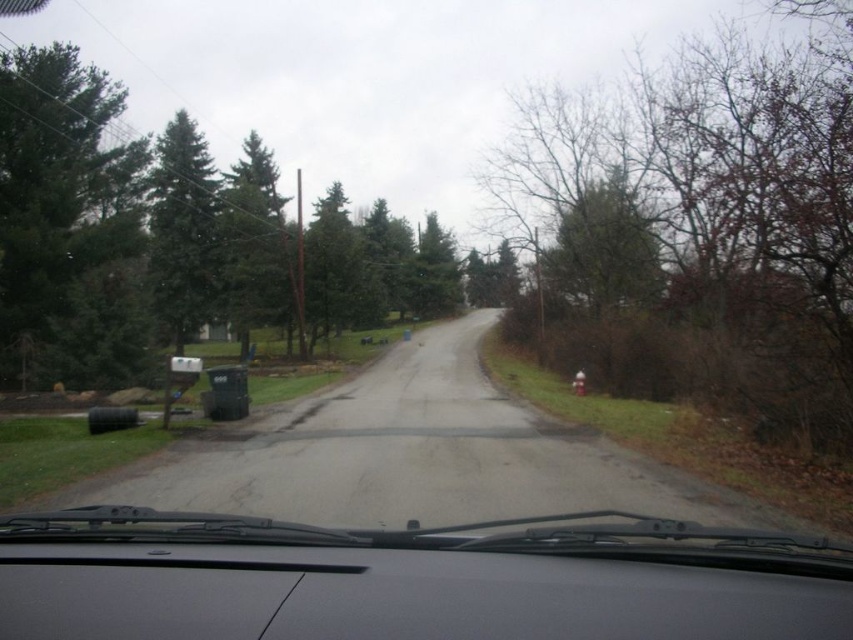
Is point (819, 316) in front of point (791, 637)?

No, (819, 316) is behind (791, 637).

Between bare branches at right and black matte windshield wipers at center, which one has more height?

bare branches at right is taller.

Is point (798, 380) in front of point (241, 570)?

No.

The image size is (853, 640). Identify the location of bare branches at right. (700, 228).

Can you confirm if green textured tree at left is taller than green matte tree at left?

Yes.

Consider the image. Who is more forward, (x=86, y=378) or (x=184, y=298)?

Point (x=86, y=378) is more forward.

Where is `green textured tree at left`? This screenshot has height=640, width=853. green textured tree at left is located at coordinates 68,227.

I want to click on green textured tree at left, so click(68, 227).

Is point (706, 252) closer to camera compared to point (178, 115)?

Yes, it is.

Between point (560, 227) and point (160, 216), which one is positioned behind?

The point (160, 216) is behind.

Does point (827, 289) come in front of point (173, 118)?

Yes, point (827, 289) is in front of point (173, 118).

At what (x,y) coordinates should I click in order to perform the action: click on bare branches at right. Please return your answer as a coordinate pair (x, y). The height and width of the screenshot is (640, 853). Looking at the image, I should click on tap(700, 228).